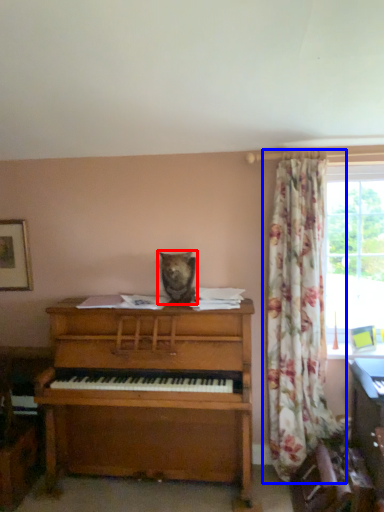
Question: Which of the following is the farthest to the observer, animal (highlighted by a red box) or curtain (highlighted by a blue box)?

Choices:
 (A) animal
 (B) curtain

Answer: (A)